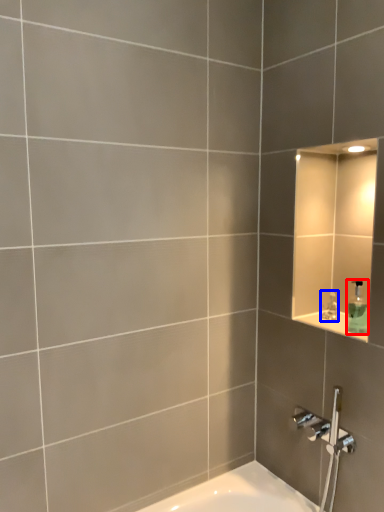
Question: Which of the following is the closest to the observer, soap dispenser (highlighted by a red box) or faucet (highlighted by a blue box)?

Choices:
 (A) soap dispenser
 (B) faucet

Answer: (A)